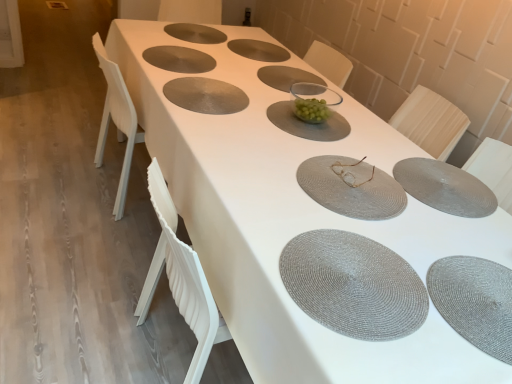
Where is `vacant space behind gray woven placemat at center`? This screenshot has width=512, height=384. vacant space behind gray woven placemat at center is located at coordinates (330, 204).